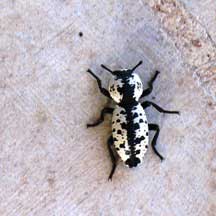
I want to click on wall, so click(72, 109).